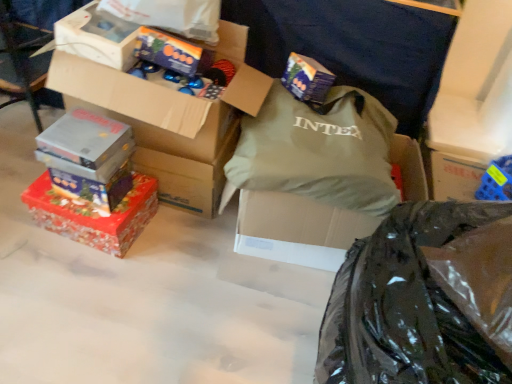
I want to click on vacant region in front of shiny red wrapping paper at lower left, placed as the seventh box when sorted from right to left, so click(72, 281).